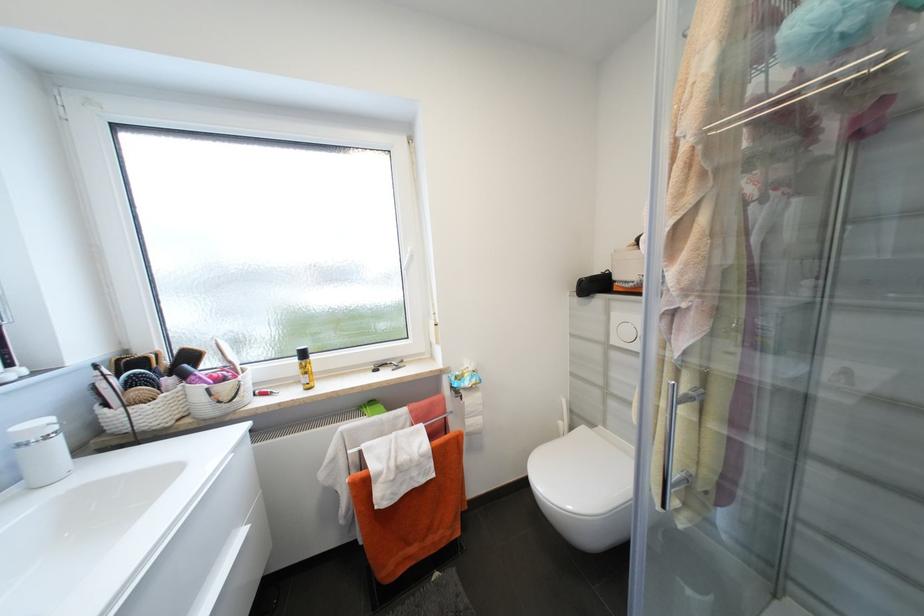
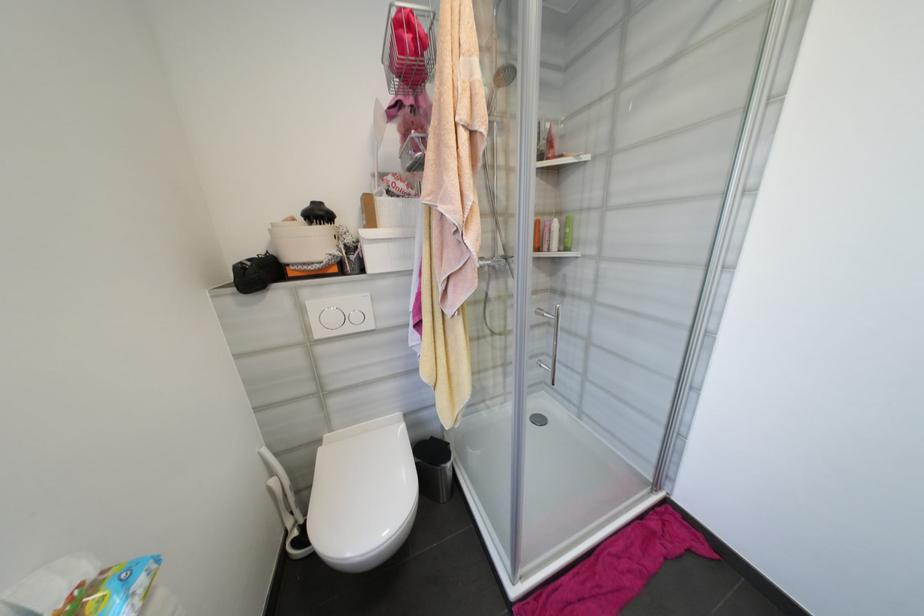
The point at (599, 427) is marked in the first image. Where is the corresponding point in the second image?

(325, 443)